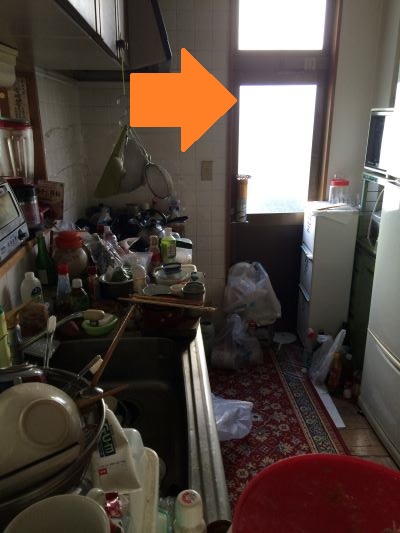
I want to click on kitchen, so click(x=216, y=369).